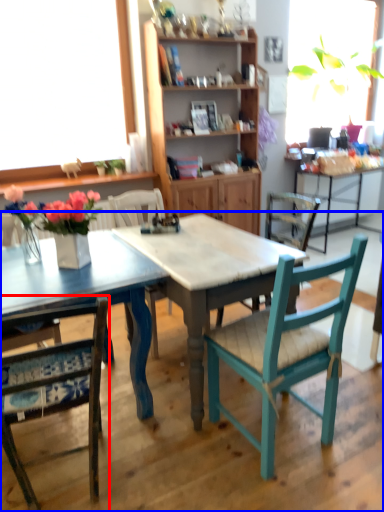
Question: Which object is closer to the camera taking this photo, chair (highlighted by a red box) or table (highlighted by a blue box)?

Choices:
 (A) chair
 (B) table

Answer: (B)